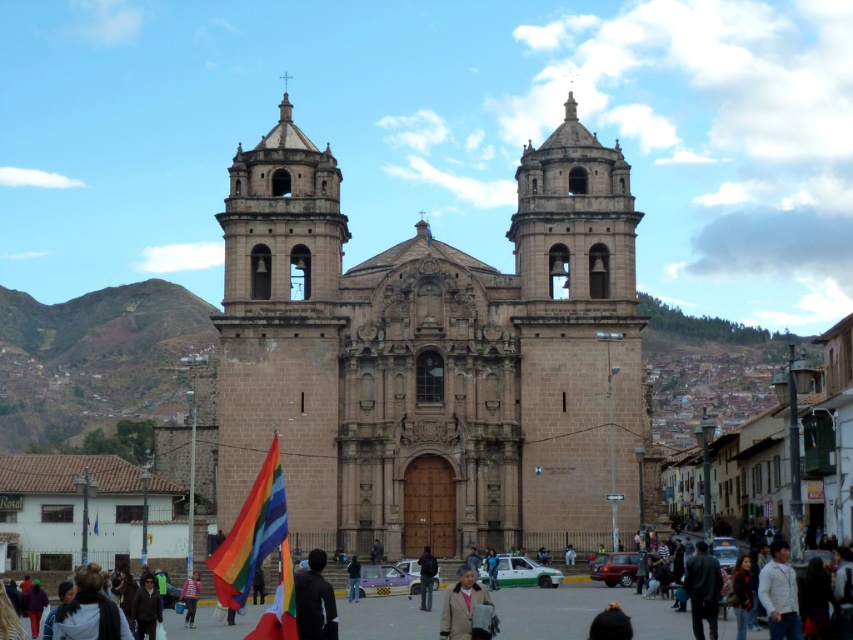
Can you confirm if white matte jacket at lower right is positioned above striped shirt at center?

Yes, white matte jacket at lower right is above striped shirt at center.

The height and width of the screenshot is (640, 853). What are the coordinates of `white matte jacket at lower right` in the screenshot? It's located at (779, 593).

I want to click on white matte jacket at lower right, so click(x=779, y=593).

Is point (785, 595) closer to viewer compared to point (422, 577)?

Yes, point (785, 595) is in front of point (422, 577).

Does white matte jacket at lower right appear on the left side of dark blue jacket at center?

Incorrect, white matte jacket at lower right is not on the left side of dark blue jacket at center.

Is point (780, 589) in front of point (433, 564)?

Yes, it is in front of point (433, 564).

The image size is (853, 640). In order to click on white matte jacket at lower right in this screenshot , I will do `click(779, 593)`.

Can you confirm if rainbow fabric flag at lower left is taller than dark blue jacket at lower left?

Yes, rainbow fabric flag at lower left is taller than dark blue jacket at lower left.

Find the location of `rainbow fabric flag at lower left`. rainbow fabric flag at lower left is located at coordinates (251, 532).

Does point (271, 536) lie behind point (125, 620)?

Yes, it is behind point (125, 620).

Where is `rainbow fabric flag at lower left`? The width and height of the screenshot is (853, 640). rainbow fabric flag at lower left is located at coordinates (251, 532).